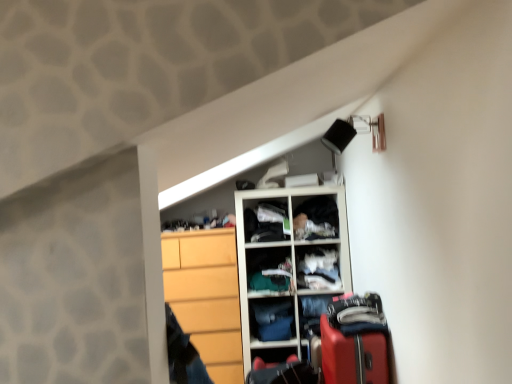
Identify the location of white plastic cabinet at upper center, arranged as the first cabinet when viewed from the top. (266, 221).

What do you see at coordinates (269, 269) in the screenshot? I see `dark blue fabric at center` at bounding box center [269, 269].

Image resolution: width=512 pixels, height=384 pixels. What do you see at coordinates (318, 269) in the screenshot? I see `white fabric at center, the 1th cabinet when ordered from right to left` at bounding box center [318, 269].

You are a GUI agent. You are given a task and a screenshot of the screen. Output one action in this format:
    pyautogui.click(x=<x>, y=<y>)
    Task: Click on the white wooden cupboard at center
    The image size is (512, 384).
    Given the screenshot: What is the action you would take?
    pyautogui.click(x=287, y=268)

The width and height of the screenshot is (512, 384). What do you see at coordinates (353, 356) in the screenshot? I see `rubberized red suitcase at lower right, arranged as the second luggage when viewed from the left` at bounding box center [353, 356].

You are a GUI agent. You are given a task and a screenshot of the screen. Output one action in this format:
    pyautogui.click(x=<x>, y=<y>)
    Task: Click on the matte black suitcase at lower right, which is the 1th luggage from back to front
    
    Given the screenshot: What is the action you would take?
    coord(283,373)

Is white plastic cabinet at upper center, arranged as the 1th cabinet when viewed from the left, oriented towards dark blue fabric at center?

No, white plastic cabinet at upper center, arranged as the 1th cabinet when viewed from the left, does not turn towards dark blue fabric at center.

Between white plastic cabinet at upper center, the second cabinet viewed from the right, and dark blue fabric at center, which one has less height?

Standing shorter between the two is dark blue fabric at center.

Is white plastic cabinet at upper center, arranged as the 1th cabinet when viewed from the left, with dark blue fabric at center?

No, white plastic cabinet at upper center, arranged as the 1th cabinet when viewed from the left, is not touching dark blue fabric at center.

From a real-world perspective, which is physically below, white plastic cabinet at upper center, the second cabinet viewed from the right, or dark blue fabric at center?

dark blue fabric at center.

Between rubberized red suitcase at lower right, arranged as the first luggage when viewed from the front, and dark gray fabric at upper center, which is counted as the 2th clothing, starting from the bottom, which one is positioned in front?

rubberized red suitcase at lower right, arranged as the first luggage when viewed from the front.

How many degrees apart are the facing directions of rubberized red suitcase at lower right, the second luggage in the back-to-front sequence, and dark gray fabric at upper center, which is counted as the 2th clothing, starting from the bottom?

82.2 degrees.

Considering the relative positions of rubberized red suitcase at lower right, the second luggage in the back-to-front sequence, and dark gray fabric at upper center, the first clothing viewed from the right, in the image provided, is rubberized red suitcase at lower right, the second luggage in the back-to-front sequence, to the right of dark gray fabric at upper center, the first clothing viewed from the right, from the viewer's perspective?

Yes, rubberized red suitcase at lower right, the second luggage in the back-to-front sequence, is to the right of dark gray fabric at upper center, the first clothing viewed from the right.

In terms of width, does rubberized red suitcase at lower right, acting as the first luggage starting from the top, look wider or thinner when compared to dark gray fabric at upper center, positioned as the second clothing in left-to-right order?

rubberized red suitcase at lower right, acting as the first luggage starting from the top, is wider than dark gray fabric at upper center, positioned as the second clothing in left-to-right order.

Is dark gray fabric at upper center, which is counted as the 2th clothing, starting from the bottom, completely or partially outside of wooden dresser at lower left?

Yes, dark gray fabric at upper center, which is counted as the 2th clothing, starting from the bottom, is not within wooden dresser at lower left.

Between dark gray fabric at upper center, which is counted as the 2th clothing, starting from the bottom, and wooden dresser at lower left, which one is positioned behind?

dark gray fabric at upper center, which is counted as the 2th clothing, starting from the bottom.

Are dark gray fabric at upper center, positioned as the second clothing in left-to-right order, and wooden dresser at lower left far apart?

dark gray fabric at upper center, positioned as the second clothing in left-to-right order, is actually quite close to wooden dresser at lower left.

Can you confirm if dark gray fabric at upper center, which appears as the first clothing when viewed from the top, is smaller than wooden dresser at lower left?

Yes, dark gray fabric at upper center, which appears as the first clothing when viewed from the top, is smaller than wooden dresser at lower left.

From a real-world perspective, between dark gray fabric at upper center, positioned as the second clothing in left-to-right order, and dark blue fabric at center, who is vertically lower?

dark blue fabric at center.

From the image's perspective, between dark gray fabric at upper center, which appears as the first clothing when viewed from the top, and dark blue fabric at center, who is located below?

dark blue fabric at center.

Considering the relative sizes of dark gray fabric at upper center, which appears as the first clothing when viewed from the top, and dark blue fabric at center in the image provided, is dark gray fabric at upper center, which appears as the first clothing when viewed from the top, thinner than dark blue fabric at center?

Correct, the width of dark gray fabric at upper center, which appears as the first clothing when viewed from the top, is less than that of dark blue fabric at center.

Does point (250, 373) come in front of point (323, 282)?

Yes, point (250, 373) is closer to viewer.

Is matte black suitcase at lower right, the second luggage from the right, taller or shorter than white wooden cupboard at center?

Clearly, matte black suitcase at lower right, the second luggage from the right, is shorter compared to white wooden cupboard at center.

Is matte black suitcase at lower right, arranged as the second luggage when viewed from the front, oriented away from white wooden cupboard at center?

No.

How many degrees apart are the facing directions of matte black suitcase at lower right, which is the 1th luggage from back to front, and white wooden cupboard at center?

matte black suitcase at lower right, which is the 1th luggage from back to front, and white wooden cupboard at center are facing 87.8 degrees away from each other.

Which object is positioned more to the left, denim pants at center, acting as the 1th clothing starting from the left, or white wooden cupboard at center?

denim pants at center, acting as the 1th clothing starting from the left, is more to the left.

Can you confirm if denim pants at center, arranged as the 2th clothing when viewed from the top, is wider than white wooden cupboard at center?

No.

Is denim pants at center, which is counted as the first clothing, starting from the bottom, positioned beyond the bounds of white wooden cupboard at center?

Actually, denim pants at center, which is counted as the first clothing, starting from the bottom, is at least partially inside white wooden cupboard at center.

The image size is (512, 384). What are the coordinates of `clothing to the right of white wooden cupboard at center` in the screenshot? It's located at (316, 218).

Which of these two, dark gray fabric at upper center, which appears as the first clothing when viewed from the top, or white wooden cupboard at center, is smaller?

With smaller size is dark gray fabric at upper center, which appears as the first clothing when viewed from the top.

From the image's perspective, is dark gray fabric at upper center, positioned as the second clothing in left-to-right order, beneath white wooden cupboard at center?

No, from the image's perspective, dark gray fabric at upper center, positioned as the second clothing in left-to-right order, is not below white wooden cupboard at center.

Is dark gray fabric at upper center, positioned as the second clothing in left-to-right order, looking in the opposite direction of white wooden cupboard at center?

Correct, dark gray fabric at upper center, positioned as the second clothing in left-to-right order, is looking away from white wooden cupboard at center.

From a real-world perspective, which cabinet is the 2nd one above the dark blue fabric at center? Please provide its 2D coordinates.

[(266, 221)]

This screenshot has height=384, width=512. Identify the location of the 2nd luggage in front of the dark gray fabric at upper center, which is counted as the 2th clothing, starting from the bottom, starting your count from the anchor. (353, 356).

Looking at this image, based on their spatial positions, is denim pants at center, which is counted as the first clothing, starting from the bottom, or white fabric at center, the 2th cabinet in the left-to-right sequence, closer to white plastic cabinet at upper center, the second cabinet viewed from the right?

white fabric at center, the 2th cabinet in the left-to-right sequence.

From the image, which object appears to be nearer to rubberized red suitcase at lower right, which ranks as the second luggage in bottom-to-top order, matte black suitcase at lower right, which is the 2th luggage in top-to-bottom order, or wooden dresser at lower left?

matte black suitcase at lower right, which is the 2th luggage in top-to-bottom order, is closer to rubberized red suitcase at lower right, which ranks as the second luggage in bottom-to-top order.

Looking at this image, from the image, which object appears to be nearer to white plastic cabinet at upper center, arranged as the first cabinet when viewed from the top, rubberized red suitcase at lower right, arranged as the second luggage when viewed from the left, or matte black suitcase at lower right, the second luggage from the right?

The object closer to white plastic cabinet at upper center, arranged as the first cabinet when viewed from the top, is matte black suitcase at lower right, the second luggage from the right.

Looking at the image, which one is located further to wooden dresser at lower left, dark gray fabric at upper center, which appears as the first clothing when viewed from the top, or rubberized red suitcase at lower right, positioned as the first luggage in right-to-left order?

Based on the image, rubberized red suitcase at lower right, positioned as the first luggage in right-to-left order, appears to be further to wooden dresser at lower left.

Which object lies further to the anchor point matte black suitcase at lower right, the first luggage in the left-to-right sequence, white fabric at center, the 1th cabinet when ordered from right to left, or rubberized red suitcase at lower right, positioned as the first luggage in right-to-left order?

The object further to matte black suitcase at lower right, the first luggage in the left-to-right sequence, is rubberized red suitcase at lower right, positioned as the first luggage in right-to-left order.

When comparing their distances from denim pants at center, arranged as the 2th clothing when viewed from the top, does rubberized red suitcase at lower right, acting as the first luggage starting from the top, or white plastic cabinet at upper center, the 2th cabinet from the bottom, seem further?

rubberized red suitcase at lower right, acting as the first luggage starting from the top, is further to denim pants at center, arranged as the 2th clothing when viewed from the top.

From the picture: Which object lies further to the anchor point white fabric at center, the 2th cabinet in the left-to-right sequence, rubberized red suitcase at lower right, acting as the first luggage starting from the top, or matte black suitcase at lower right, the first luggage in the left-to-right sequence?

The object further to white fabric at center, the 2th cabinet in the left-to-right sequence, is rubberized red suitcase at lower right, acting as the first luggage starting from the top.

Which object lies further to the anchor point wooden dresser at lower left, matte black suitcase at lower right, which is the 2th luggage in top-to-bottom order, or dark gray fabric at upper center, positioned as the second clothing in left-to-right order?

dark gray fabric at upper center, positioned as the second clothing in left-to-right order, is further to wooden dresser at lower left.

Locate an element on the screen. This screenshot has width=512, height=384. clothing that lies between white fabric at center, which is the 2th cabinet from top to bottom, and matte black suitcase at lower right, the 1th luggage positioned from the bottom, from top to bottom is located at coordinates (273, 320).

Find the location of a particular element. clothing between white wooden cupboard at center and matte black suitcase at lower right, which is the 1th luggage from back to front, in the vertical direction is located at coordinates (273, 320).

At what (x,y) coordinates should I click in order to perform the action: click on shelf between dark gray fabric at upper center, which is counted as the 2th clothing, starting from the bottom, and white wooden cupboard at center vertically. Please return your answer as a coordinate pair (x, y). The height and width of the screenshot is (384, 512). Looking at the image, I should click on (269, 269).

This screenshot has width=512, height=384. I want to click on shelf that lies between white plastic cabinet at upper center, the second cabinet viewed from the right, and matte black suitcase at lower right, which is the 1th luggage from back to front, from top to bottom, so click(269, 269).